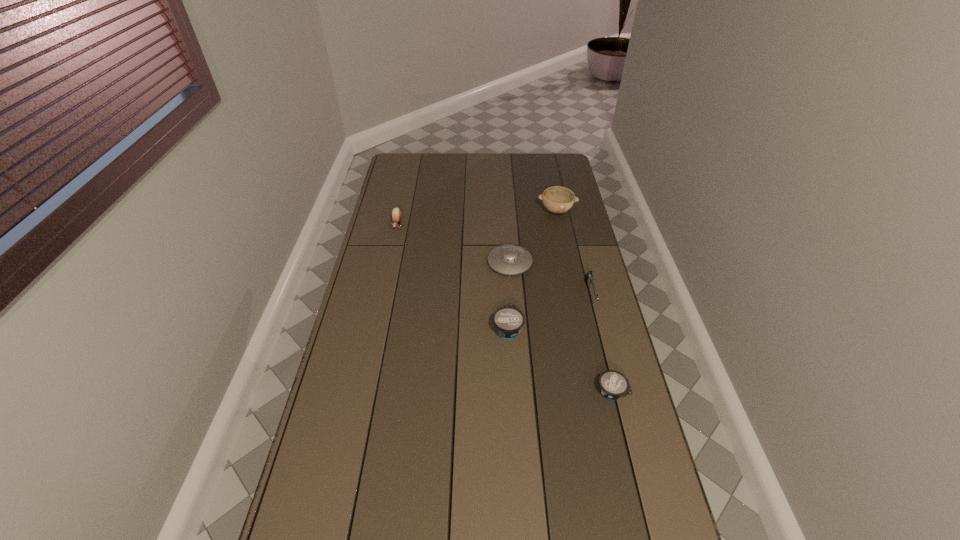
In the image, there is a desktop. Where is `vacant space at the left edge`? This screenshot has height=540, width=960. vacant space at the left edge is located at coordinates (394, 293).

Identify the location of free space at the right edge of the desktop. The image size is (960, 540). (578, 236).

Image resolution: width=960 pixels, height=540 pixels. Identify the location of vacant space at the far right corner of the desktop. (564, 176).

Identify the location of unoccupied position between the left yogurt and the saucer. The image size is (960, 540). (509, 296).

Locate an element on the screen. This screenshot has height=540, width=960. empty space that is in between the fifth farthest object and the right yogurt is located at coordinates (560, 360).

Locate an element on the screen. The height and width of the screenshot is (540, 960). unoccupied position between the saucer and the fifth farthest object is located at coordinates (509, 296).

I want to click on unoccupied position between the farther yogurt and the tallest object, so click(x=532, y=270).

The height and width of the screenshot is (540, 960). In order to click on vacant area that lies between the leftmost object and the farther yogurt in this screenshot , I will do `click(452, 277)`.

You are a GUI agent. You are given a task and a screenshot of the screen. Output one action in this format:
    pyautogui.click(x=<x>, y=<y>)
    Task: Click on the vacant point located between the saucer and the tallest object
    The width and height of the screenshot is (960, 540).
    Given the screenshot: What is the action you would take?
    (x=534, y=237)

You are a GUI agent. You are given a task and a screenshot of the screen. Output one action in this format:
    pyautogui.click(x=<x>, y=<y>)
    Task: Click on the vacant point located between the leftmost object and the taller yogurt
    
    Given the screenshot: What is the action you would take?
    pyautogui.click(x=452, y=277)